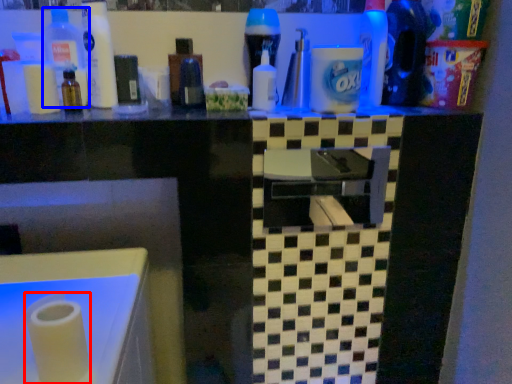
Question: Among these objects, which one is farthest to the camera, paper towel (highlighted by a red box) or bottle (highlighted by a blue box)?

Choices:
 (A) paper towel
 (B) bottle

Answer: (B)